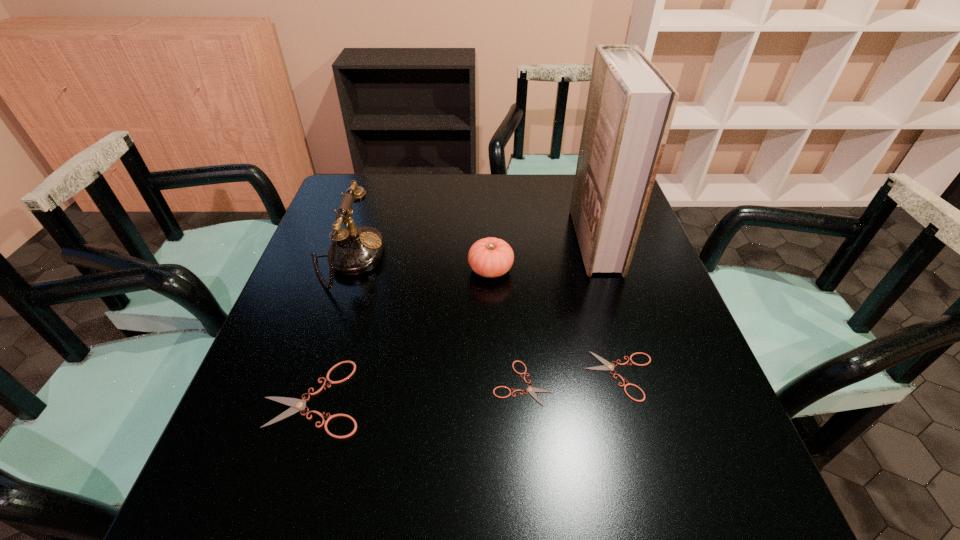
This screenshot has height=540, width=960. In order to click on vacant spot for a new shears to ensure equal spacing in this screenshot , I will do `click(420, 390)`.